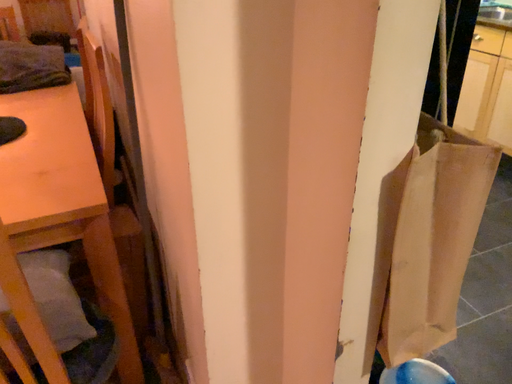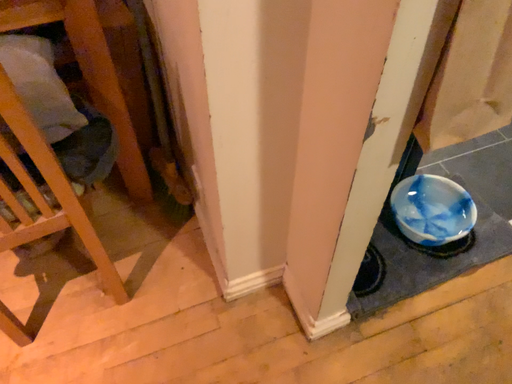
Question: How did the camera likely rotate when shooting the video?

Choices:
 (A) rotated downward
 (B) rotated upward

Answer: (A)